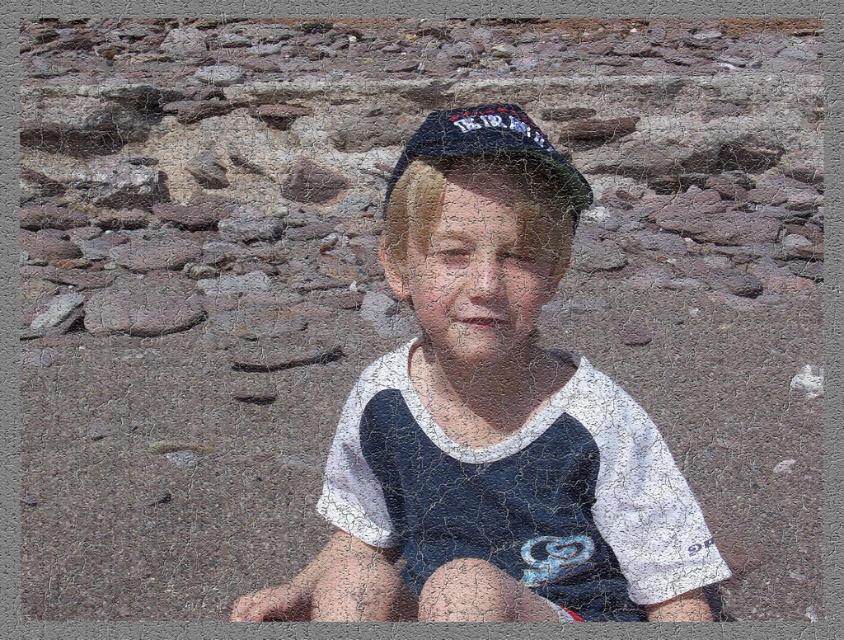
You are a photographer trying to capture a closeup of the white cotton shirt at center and the dark blue fabric baseball hat at center. Which object should you focus on first to ensure both are in focus?

The white cotton shirt at center is closer to the viewer than the dark blue fabric baseball hat at center. To ensure both are in focus, you should focus on the white cotton shirt at center first, as it is closer, and the depth of field will naturally include the farther object.

You are a fashion designer observing the boy in the image. You need to determine the placement of the white cotton shirt at center and dark blue fabric baseball hat at center. Which clothing item is located higher on the boy?

The dark blue fabric baseball hat at center is located higher than the white cotton shirt at center because the shirt is positioned under the hat.

In the scene shown: You are a tailor who needs to determine which item, the white cotton shirt at center or the dark blue fabric baseball hat at center, requires more fabric to make. Based on the scene, which one would need more material?

The white cotton shirt at center is larger in size than the dark blue fabric baseball hat at center, so it would require more fabric to make.